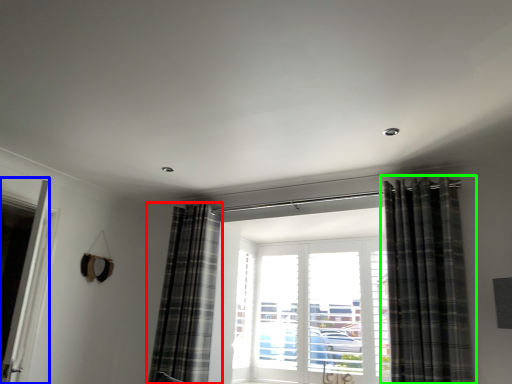
Question: Which object is the closest to the curtain (highlighted by a red box)? Choose among these: screen door (highlighted by a blue box) or curtain (highlighted by a green box).

Choices:
 (A) screen door
 (B) curtain

Answer: (A)